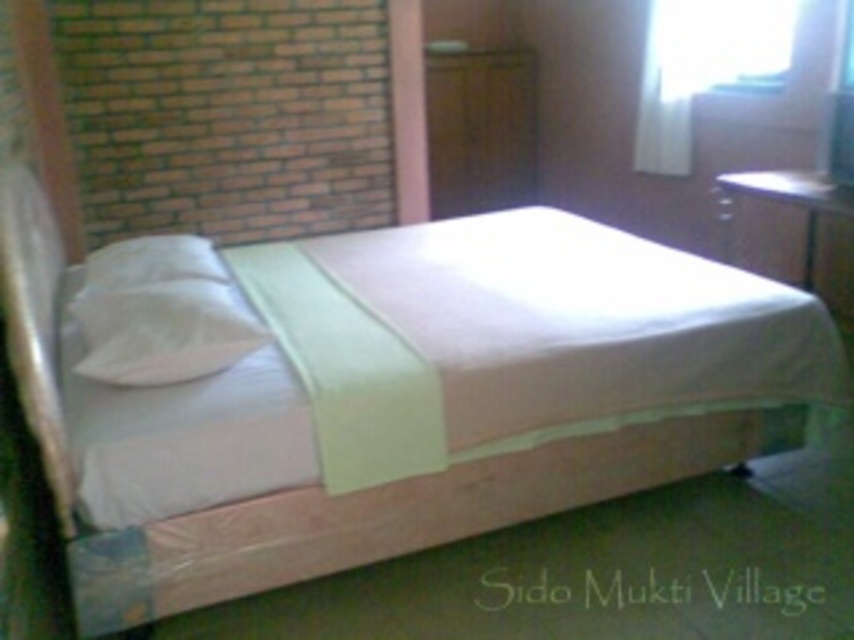
Question: Is white fabric bed at center below white soft pillow at left?

Choices:
 (A) yes
 (B) no

Answer: (B)

Question: Which point is farther to the camera?

Choices:
 (A) (167, 326)
 (B) (437, 195)

Answer: (B)

Question: Does white soft pillow at left appear on the right side of matte wood dresser at upper right?

Choices:
 (A) no
 (B) yes

Answer: (A)

Question: Which of these objects is positioned farthest from the white fabric bed at center?

Choices:
 (A) wooden dresser at center
 (B) white soft pillow at left

Answer: (A)

Question: Is transparent glass window at upper right further to camera compared to white soft pillow at left?

Choices:
 (A) yes
 (B) no

Answer: (A)

Question: Among these objects, which one is nearest to the camera?

Choices:
 (A) white soft pillow at left
 (B) matte wood dresser at upper right

Answer: (A)